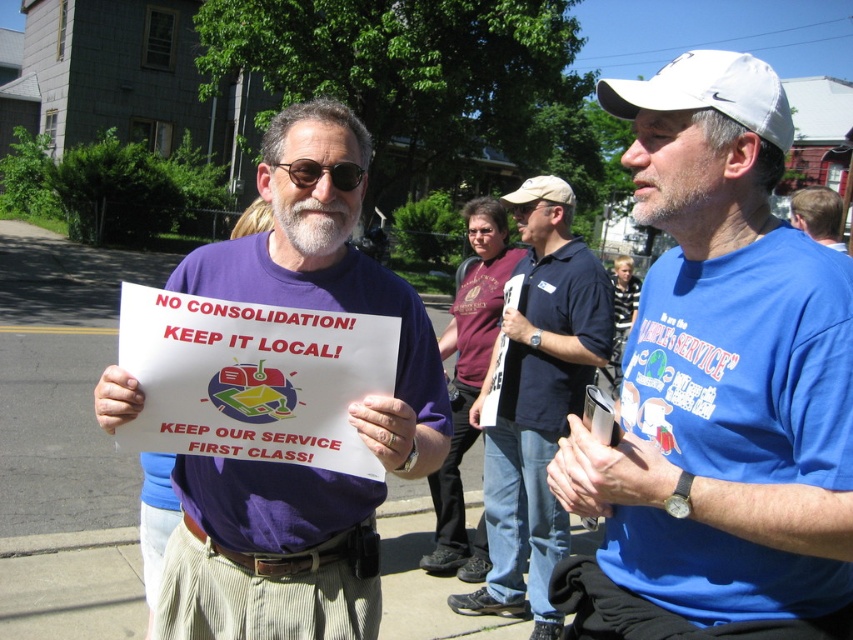
Question: Which of the following is the closest to the observer?

Choices:
 (A) purple fabric shirt at center
 (B) black plastic sunglasses at center
 (C) blue cotton t-shirt at center

Answer: (C)

Question: Does dark blue shirt at center have a greater width compared to graywoollybeard at center?

Choices:
 (A) yes
 (B) no

Answer: (A)

Question: Is purple fabric shirt at center further to the viewer compared to dark blue shirt at center?

Choices:
 (A) yes
 (B) no

Answer: (B)

Question: Can you confirm if graywoollybeard at center is positioned to the right of beige fabric baseball cap at upper center?

Choices:
 (A) no
 (B) yes

Answer: (A)

Question: Considering the real-world distances, which object is farthest from the white fabric baseball cap at upper right?

Choices:
 (A) black plastic sunglasses at center
 (B) graywoollybeard at center
 (C) blue cotton t-shirt at center

Answer: (A)

Question: Based on their relative distances, which object is farther from the graywoollybeard at center?

Choices:
 (A) white fabric baseball cap at upper right
 (B) blue t-shirt at right
 (C) dark blue shirt at center

Answer: (C)